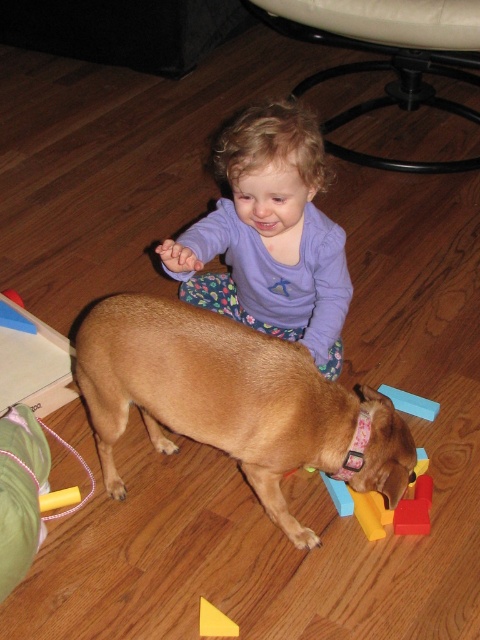
Question: Where is golden brown fur at center located in relation to blue rubber block at center in the image?

Choices:
 (A) below
 (B) above

Answer: (A)

Question: Is golden brown fur at center to the left of yellow plastic triangle at lower center from the viewer's perspective?

Choices:
 (A) yes
 (B) no

Answer: (B)

Question: Does purple soft shirt at center appear on the left side of blue rubber block at center?

Choices:
 (A) yes
 (B) no

Answer: (A)

Question: Which object is closer to the camera taking this photo?

Choices:
 (A) purple soft shirt at center
 (B) blue rubber block at center
 (C) golden brown fur at center

Answer: (C)

Question: Which point is closer to the camera taking this photo?

Choices:
 (A) (408, 406)
 (B) (254, 177)

Answer: (B)

Question: Which is nearer to the purple soft shirt at center?

Choices:
 (A) golden brown fur at center
 (B) blue rubber block at center

Answer: (A)